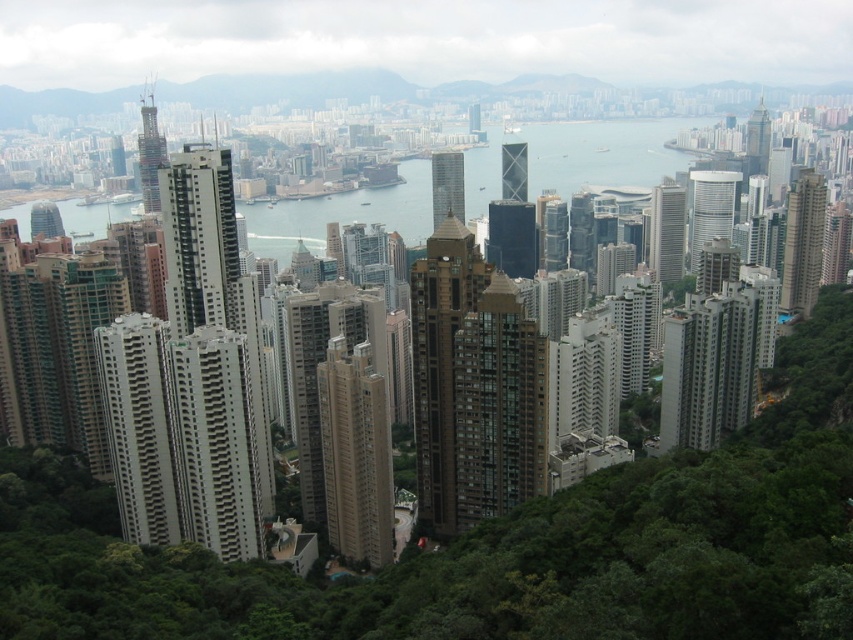
Which is in front, point (132, 387) or point (650, 260)?

Positioned in front is point (132, 387).

Which is behind, point (148, 461) or point (672, 266)?

The point (672, 266) is behind.

Who is more distant from viewer, (120,417) or (682,264)?

Positioned behind is point (682,264).

This screenshot has width=853, height=640. Identify the location of white smooth building at left. (138, 426).

Measure the distance between beige concrete building at center and camera.

The distance of beige concrete building at center from camera is 307.81 meters.

Is beige concrete building at center closer to the viewer compared to shiny glass skyscraper at upper right?

Yes.

What do you see at coordinates (355, 454) in the screenshot? The width and height of the screenshot is (853, 640). I see `beige concrete building at center` at bounding box center [355, 454].

The image size is (853, 640). Find the location of `beige concrete building at center`. beige concrete building at center is located at coordinates (355, 454).

What do you see at coordinates (447, 186) in the screenshot?
I see `matte glass skyscraper at center` at bounding box center [447, 186].

Between matte glass skyscraper at center and shiny glass skyscraper at upper right, which one appears on the right side from the viewer's perspective?

Positioned to the right is shiny glass skyscraper at upper right.

The width and height of the screenshot is (853, 640). What do you see at coordinates (447, 186) in the screenshot?
I see `matte glass skyscraper at center` at bounding box center [447, 186].

Image resolution: width=853 pixels, height=640 pixels. In order to click on matte glass skyscraper at center in this screenshot , I will do `click(447, 186)`.